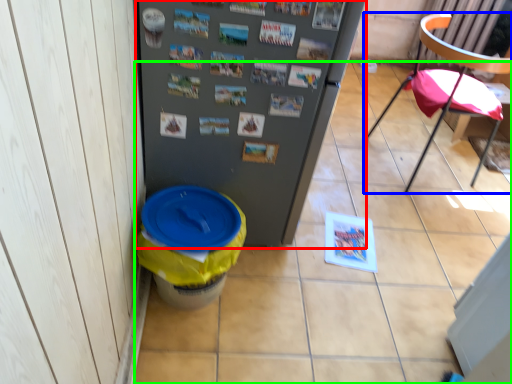
Question: Which object is the farthest from refrigerator (highlighted by a red box)? Choose among these: chair (highlighted by a blue box) or tile (highlighted by a green box).

Choices:
 (A) chair
 (B) tile

Answer: (A)